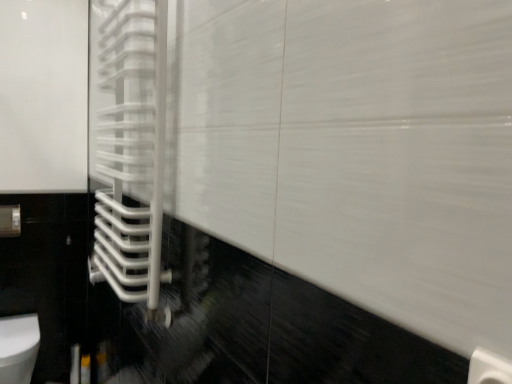
Question: From a real-world perspective, is white glossy towel rack at left beneath white glossy toilet at lower left?

Choices:
 (A) no
 (B) yes

Answer: (A)

Question: Is white glossy towel rack at left at the right side of white glossy toilet at lower left?

Choices:
 (A) yes
 (B) no

Answer: (A)

Question: Considering the relative sizes of white glossy towel rack at left and white glossy toilet at lower left in the image provided, is white glossy towel rack at left smaller than white glossy toilet at lower left?

Choices:
 (A) yes
 (B) no

Answer: (B)

Question: Does white glossy towel rack at left come behind white glossy toilet at lower left?

Choices:
 (A) no
 (B) yes

Answer: (A)

Question: Is white glossy towel rack at left touching white glossy toilet at lower left?

Choices:
 (A) yes
 (B) no

Answer: (B)

Question: Is white glossy toilet at lower left a part of white glossy towel rack at left?

Choices:
 (A) no
 (B) yes

Answer: (A)

Question: Does white glossy toilet at lower left turn towards white glossy towel rack at left?

Choices:
 (A) no
 (B) yes

Answer: (A)

Question: From a real-world perspective, is white glossy toilet at lower left located higher than white glossy towel rack at left?

Choices:
 (A) yes
 (B) no

Answer: (B)

Question: From the image's perspective, is white glossy toilet at lower left beneath white glossy towel rack at left?

Choices:
 (A) no
 (B) yes

Answer: (B)

Question: Is white glossy toilet at lower left located outside white glossy towel rack at left?

Choices:
 (A) no
 (B) yes

Answer: (B)

Question: Is there a large distance between white glossy toilet at lower left and white glossy towel rack at left?

Choices:
 (A) no
 (B) yes

Answer: (B)

Question: Can you confirm if white glossy toilet at lower left is shorter than white glossy towel rack at left?

Choices:
 (A) yes
 (B) no

Answer: (A)

Question: From the image's perspective, is white glossy toilet at lower left above or below white glossy towel rack at left?

Choices:
 (A) above
 (B) below

Answer: (B)